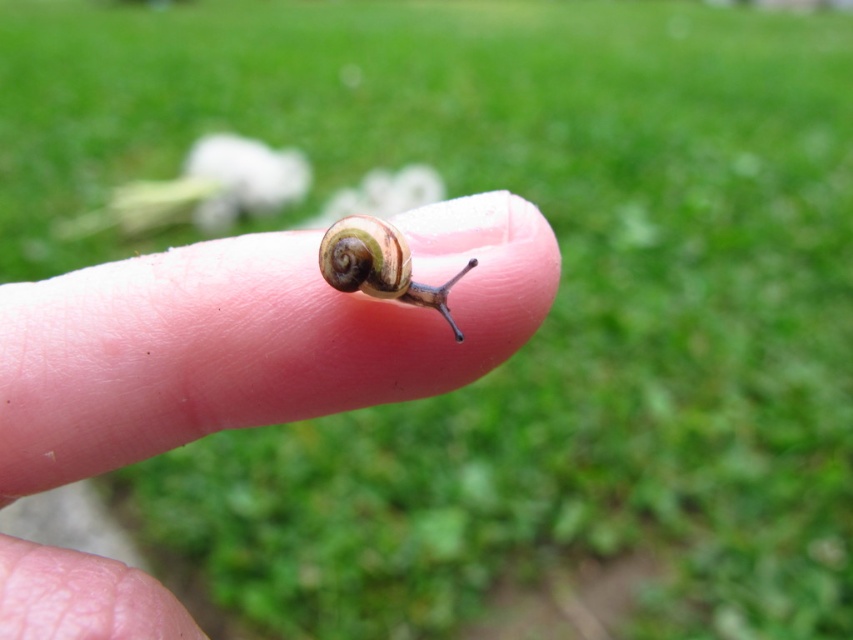
You are a photographer trying to capture the snail on the finger. The snail is at point (251,339). Where should you focus your camera to ensure the snail is in sharp focus?

You should focus your camera on the pink flesh at center where the point (251,339) is located to ensure the snail is in sharp focus.

You are a biologist observing a snail on a human hand. You notice the pink flesh at center and the shiny brown snail at center. Which object occupies more space in the image?

The pink flesh at center occupies more space in the image because it is bigger than the shiny brown snail at center.